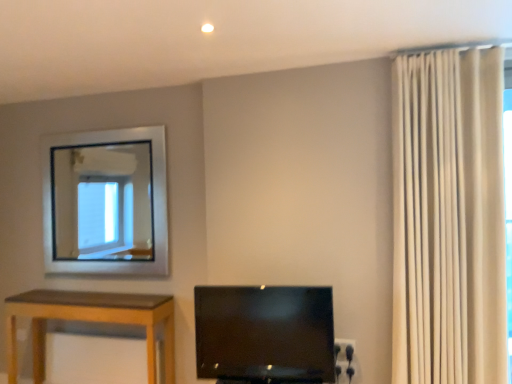
Where is `vacant region above white textured curtain at right (from a real-world perspective)`? The width and height of the screenshot is (512, 384). vacant region above white textured curtain at right (from a real-world perspective) is located at coordinates (419, 48).